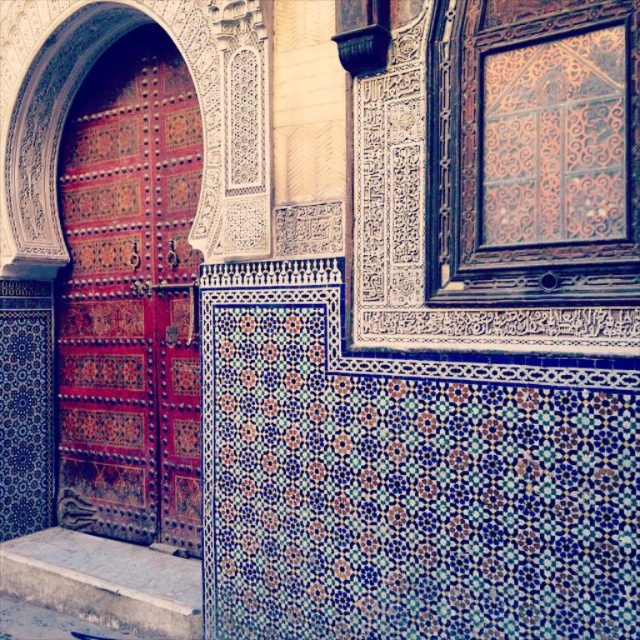
Does polished wood door at left appear on the right side of smooth stone step at lower left?

In fact, polished wood door at left is to the left of smooth stone step at lower left.

Does polished wood door at left lie behind smooth stone step at lower left?

Yes, polished wood door at left is further from the viewer.

At what (x,y) coordinates should I click in order to perform the action: click on polished wood door at left. Please return your answer as a coordinate pair (x, y). This screenshot has height=640, width=640. Looking at the image, I should click on (131, 300).

The image size is (640, 640). Find the location of `polished wood door at left`. polished wood door at left is located at coordinates (131, 300).